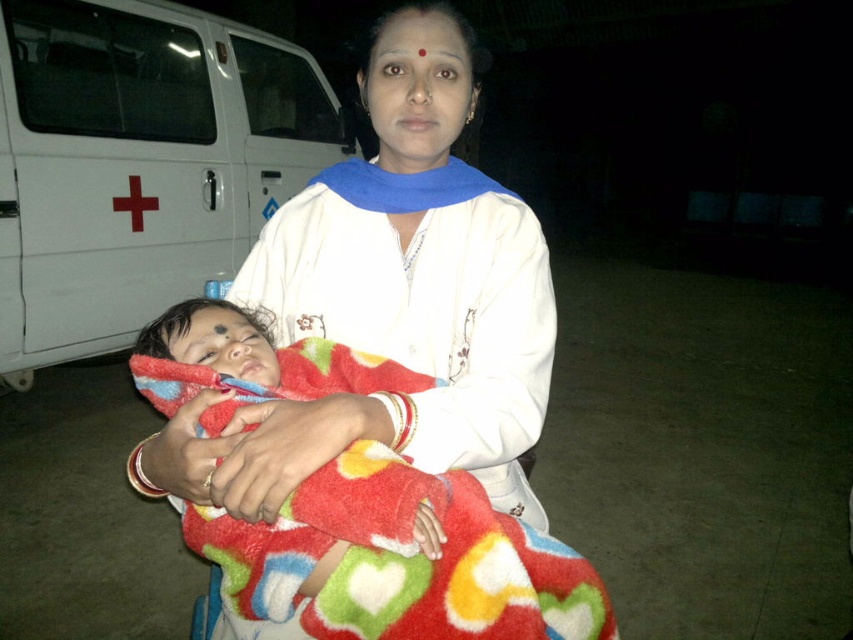
Can you confirm if white matte van at left is smaller than white soft cloth at center?

No, white matte van at left is not smaller than white soft cloth at center.

Can you confirm if white matte van at left is positioned below white soft cloth at center?

Incorrect, white matte van at left is not positioned below white soft cloth at center.

Is point (59, 138) closer to viewer compared to point (378, 237)?

No, it is behind (378, 237).

Identify the location of white matte van at left. (138, 163).

Is white matte van at left positioned in front of pink matte lips at center?

That is False.

Between point (225, 33) and point (421, 115), which one is positioned behind?

Positioned behind is point (225, 33).

What do you see at coordinates (138, 163) in the screenshot? This screenshot has width=853, height=640. I see `white matte van at left` at bounding box center [138, 163].

Identify the location of white matte van at left. This screenshot has height=640, width=853. (138, 163).

Does white soft cloth at center appear on the left side of fluffy multicolored blanket at center?

Indeed, white soft cloth at center is positioned on the left side of fluffy multicolored blanket at center.

Which of these two, white soft cloth at center or fluffy multicolored blanket at center, stands shorter?

With less height is fluffy multicolored blanket at center.

Between point (459, 243) and point (410, 381), which one is positioned behind?

The point (459, 243) is behind.

At what (x,y) coordinates should I click in order to perform the action: click on white soft cloth at center. Please return your answer as a coordinate pair (x, y). This screenshot has width=853, height=640. Looking at the image, I should click on (x=405, y=291).